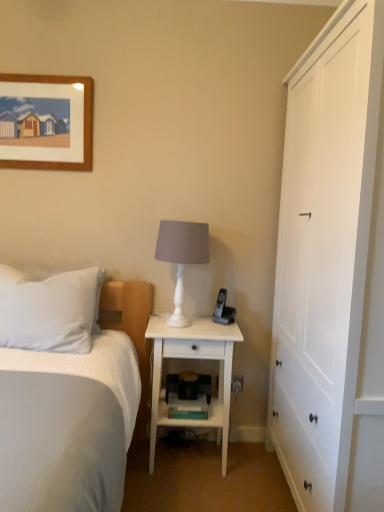
Question: Are black plastic phone at right and white wood cabinet at right far apart?

Choices:
 (A) no
 (B) yes

Answer: (A)

Question: Is black plastic phone at right touching white wood cabinet at right?

Choices:
 (A) yes
 (B) no

Answer: (B)

Question: Is black plastic phone at right oriented towards white wood cabinet at right?

Choices:
 (A) yes
 (B) no

Answer: (B)

Question: From a real-world perspective, is black plastic phone at right over white wood cabinet at right?

Choices:
 (A) no
 (B) yes

Answer: (A)

Question: From a real-world perspective, is black plastic phone at right beneath white wood cabinet at right?

Choices:
 (A) no
 (B) yes

Answer: (B)

Question: Is black plastic phone at right shorter than white wood cabinet at right?

Choices:
 (A) yes
 (B) no

Answer: (A)

Question: Is the depth of white wood nightstand at center less than that of white matte lamp at center?

Choices:
 (A) yes
 (B) no

Answer: (B)

Question: Can you confirm if white wood nightstand at center is positioned to the right of white matte lamp at center?

Choices:
 (A) no
 (B) yes

Answer: (B)

Question: Can you see white wood nightstand at center touching white matte lamp at center?

Choices:
 (A) no
 (B) yes

Answer: (A)

Question: Does white wood nightstand at center turn towards white matte lamp at center?

Choices:
 (A) yes
 (B) no

Answer: (B)

Question: Considering the relative positions of white wood nightstand at center and white matte lamp at center in the image provided, is white wood nightstand at center behind white matte lamp at center?

Choices:
 (A) no
 (B) yes

Answer: (B)

Question: Can you confirm if white wood nightstand at center is thinner than white matte lamp at center?

Choices:
 (A) yes
 (B) no

Answer: (B)

Question: Would you say white textured bed at left is a long distance from black plastic phone at right?

Choices:
 (A) yes
 (B) no

Answer: (B)